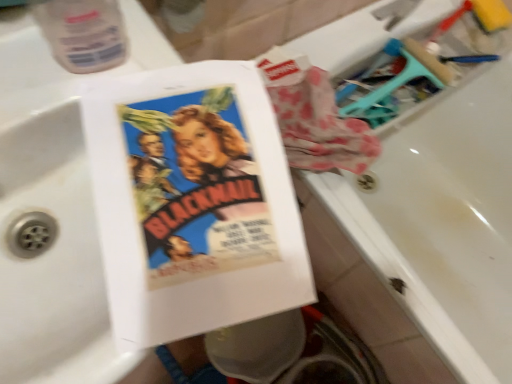
Question: From a real-world perspective, is matte paper book at center positioned above or below white glossy bathtub at upper right?

Choices:
 (A) above
 (B) below

Answer: (A)

Question: Is matte paper book at center to the left or to the right of white glossy bathtub at upper right in the image?

Choices:
 (A) right
 (B) left

Answer: (B)

Question: Based on their relative distances, which object is farther from the matte paper book at center?

Choices:
 (A) transparent plastic bottle at upper left
 (B) white glossy bathtub at upper right

Answer: (B)

Question: Which object is the farthest from the white glossy bathtub at upper right?

Choices:
 (A) transparent plastic bottle at upper left
 (B) matte paper book at center

Answer: (A)